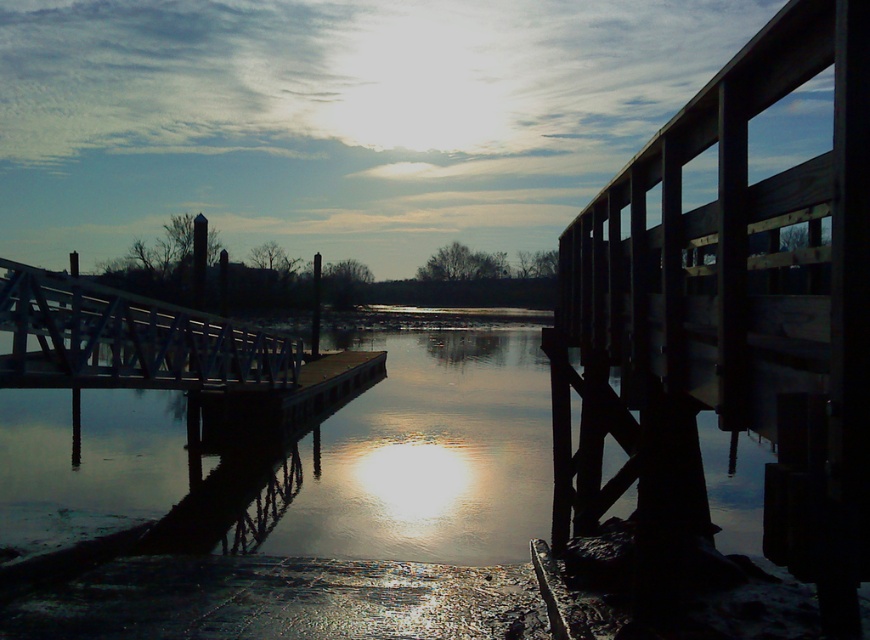
You are a painter wanting to capture the scene. You have a canvas that can only fit objects up to the width of the white metal bridge at left. Can you paint the wooden rail at right on this canvas?

The wooden rail at right has a larger width than the white metal bridge at left, so it cannot fit on the canvas designed for the bridge.

You are standing on the dock and want to lean against the wooden rail at right. Based on its position, can you estimate where exactly it is located on the dock?

The wooden rail at right is located at point 0.477 along the horizontal axis and 0.843 along the vertical axis of the dock.